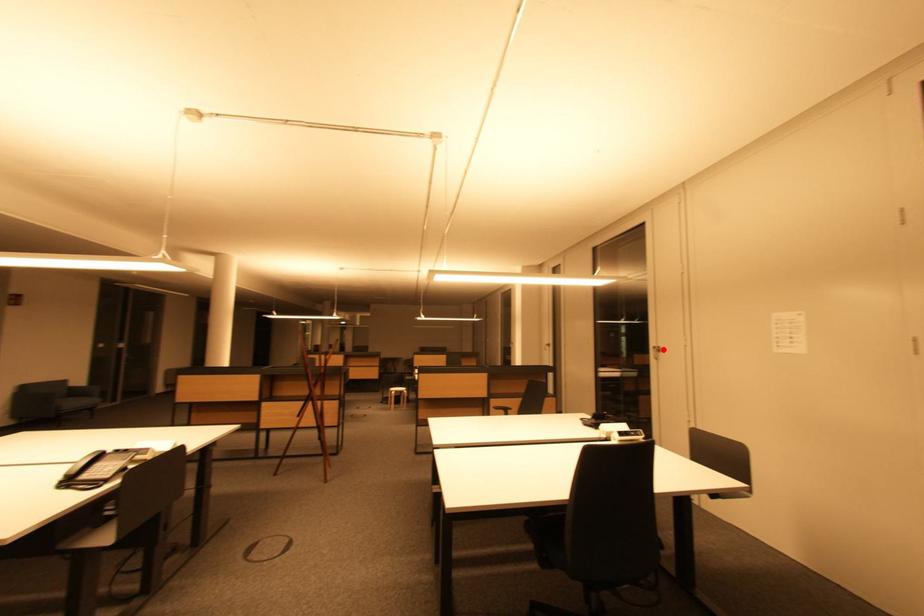
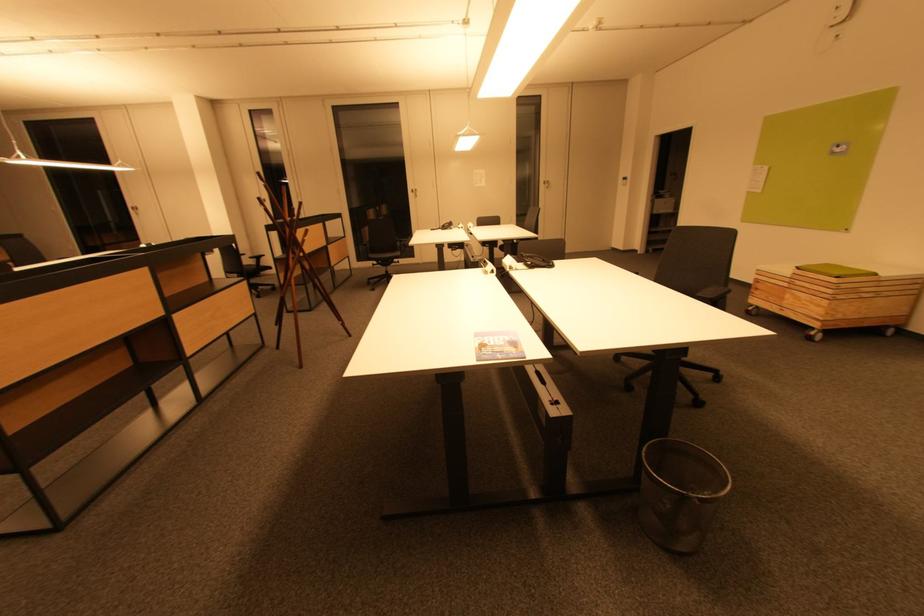
Question: I am providing you with two images of the same scene from different viewpoints. Image1 has a red point marked. In image2, the corresponding 3D location appears at what relative position? Reply with the corresponding letter.

Choices:
 (A) Closer
 (B) Farther

Answer: (A)